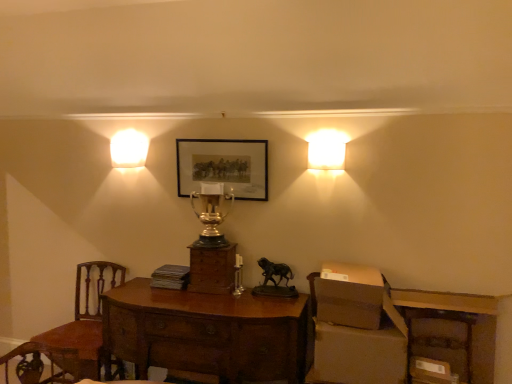
Question: Is gold polished trophy at center spatially inside brown cardboard box at lower right, the 3th cardboard box positioned from the top, or outside of it?

Choices:
 (A) outside
 (B) inside

Answer: (A)

Question: From the image's perspective, relative to brown cardboard box at lower right, acting as the first cardboard box starting from the bottom, is gold polished trophy at center above or below?

Choices:
 (A) below
 (B) above

Answer: (B)

Question: Estimate the real-world distances between objects in this image. Which object is farther from the mahogany wood chair at left?

Choices:
 (A) brown cardboard box at right, the 1th cardboard box when ordered from top to bottom
 (B) matte black picture frame at center
 (C) brown cardboard box at lower right, which is the second cardboard box in top-to-bottom order
 (D) brown wooden desk at lower right
 (E) brown cardboard box at lower right, acting as the first cardboard box starting from the bottom

Answer: (E)

Question: Considering the real-world distances, which object is closest to the mahogany wood desk at center?

Choices:
 (A) brown cardboard box at lower right, placed as the 2th cardboard box when sorted from bottom to top
 (B) matte white square at upper right, the second lamp viewed from the left
 (C) matte black picture frame at center
 (D) brown cardboard box at right, which is counted as the third cardboard box, starting from the bottom
 (E) gold polished trophy at center

Answer: (A)